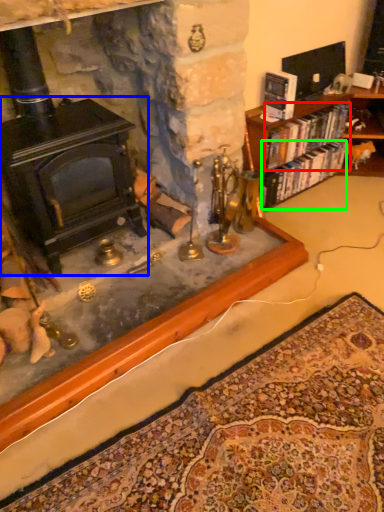
Question: Estimate the real-world distances between objects in this image. Which object is farther from book (highlighted by a red box), fireplace (highlighted by a blue box) or book (highlighted by a green box)?

Choices:
 (A) fireplace
 (B) book

Answer: (A)